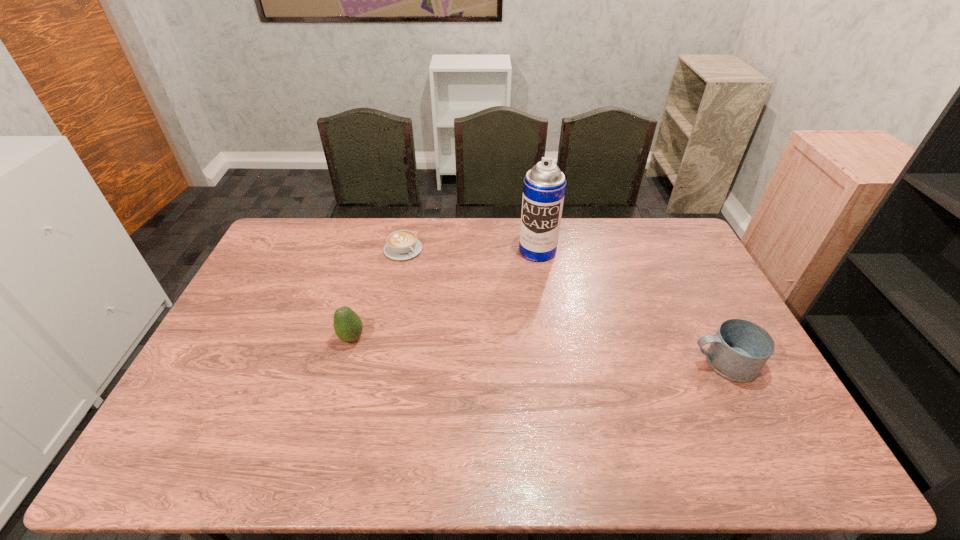
You are a GUI agent. You are given a task and a screenshot of the screen. Output one action in this format:
    pyautogui.click(x=<x>, y=<y>)
    Task: Click on the free area in between the second object from right to left and the avocado
    Image resolution: width=960 pixels, height=540 pixels.
    Given the screenshot: What is the action you would take?
    pyautogui.click(x=444, y=294)

Find the location of a particular element. empty space that is in between the cappuccino and the rightmost object is located at coordinates (564, 306).

Locate an element on the screen. Image resolution: width=960 pixels, height=540 pixels. vacant space that is in between the aerosol can and the avocado is located at coordinates (444, 294).

This screenshot has width=960, height=540. What are the coordinates of `unoccupied area between the tallest object and the avocado` in the screenshot? It's located at (444, 294).

At what (x,y) coordinates should I click in order to perform the action: click on vacant area between the cappuccino and the avocado. Please return your answer as a coordinate pair (x, y). Looking at the image, I should click on (377, 294).

Point out which object is positioned as the third nearest to the avocado. Please provide its 2D coordinates. Your answer should be formatted as a tuple, i.e. [(x, y)], where the tuple contains the x and y coordinates of a point satisfying the conditions above.

[(740, 349)]

I want to click on object that ranks as the closest to the mug, so click(x=544, y=186).

Locate an element on the screen. The height and width of the screenshot is (540, 960). vacant space that satisfies the following two spatial constraints: 1. on the back side of the shortest object; 2. on the left side of the avocado is located at coordinates (376, 249).